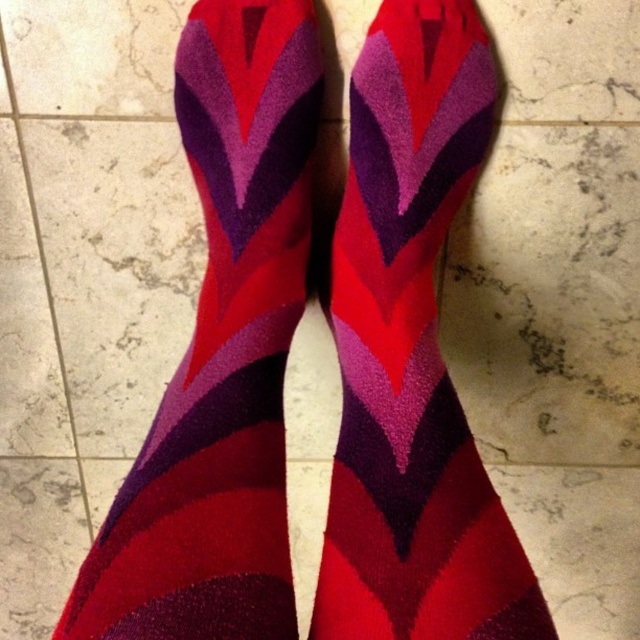
The height and width of the screenshot is (640, 640). What do you see at coordinates (221, 353) in the screenshot? I see `velvet-like red socks at center` at bounding box center [221, 353].

Does velvet-like red socks at center come in front of matte wool socks at center?

Yes, it is in front of matte wool socks at center.

Between point (93, 611) and point (388, 596), which one is positioned in front?

Positioned in front is point (93, 611).

At what (x,y) coordinates should I click in order to perform the action: click on velvet-like red socks at center. Please return your answer as a coordinate pair (x, y). The width and height of the screenshot is (640, 640). Looking at the image, I should click on point(221,353).